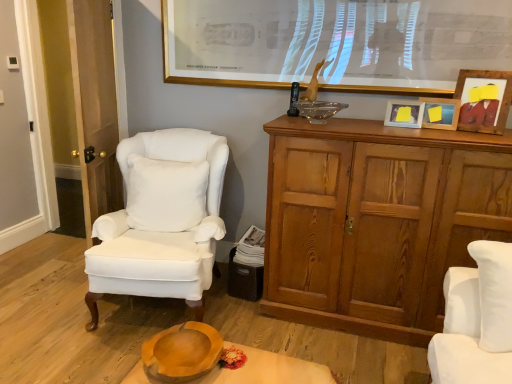
Locate an element on the screen. The width and height of the screenshot is (512, 384). free space to the left of white fabric chair at left, the first chair from the left is located at coordinates point(45,286).